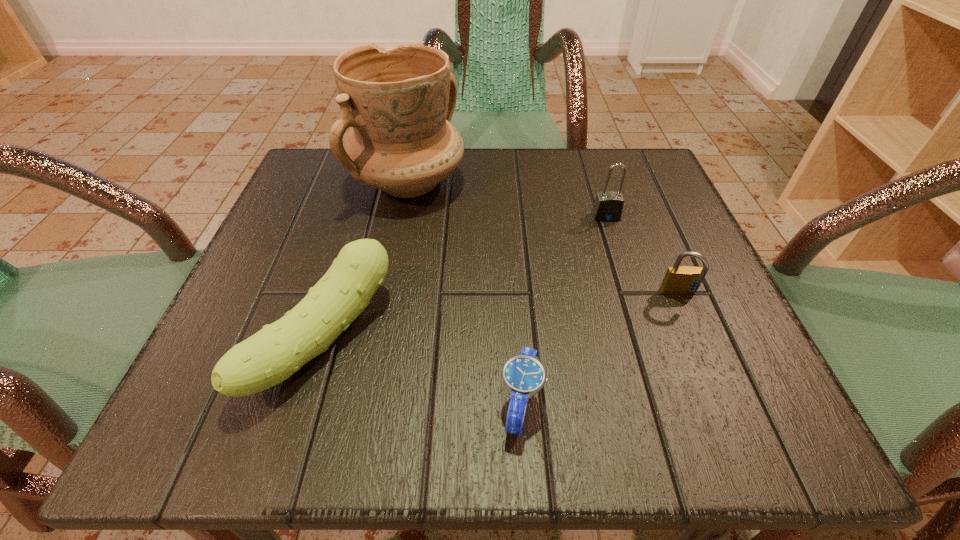
You are a GUI agent. You are given a task and a screenshot of the screen. Output one action in this format:
    pyautogui.click(x=<x>, y=<y>)
    Task: Click on the vacant space located on the right of the cucumber
    
    Given the screenshot: What is the action you would take?
    pyautogui.click(x=485, y=339)

At what (x,y) coordinates should I click in order to perform the action: click on free space located on the side with the combination dials of the shorter padlock. Please return your answer as a coordinate pair (x, y). Looking at the image, I should click on (714, 379).

Find the location of a particular element. The width and height of the screenshot is (960, 540). vacant point located on the left of the third object from left to right is located at coordinates (373, 403).

The width and height of the screenshot is (960, 540). What are the coordinates of `pottery positioned at the far edge` in the screenshot? It's located at (399, 102).

I want to click on padlock situated at the far edge, so click(608, 206).

Locate an element on the screen. The width and height of the screenshot is (960, 540). cucumber situated at the near edge is located at coordinates (270, 356).

Where is `watch located at the near edge`? Image resolution: width=960 pixels, height=540 pixels. watch located at the near edge is located at coordinates (523, 375).

What are the coordinates of `pottery present at the left edge` in the screenshot? It's located at (399, 102).

The image size is (960, 540). Identify the location of cucumber situated at the left edge. (270, 356).

Locate an element on the screen. The width and height of the screenshot is (960, 540). object that is positioned at the far left corner is located at coordinates (399, 102).